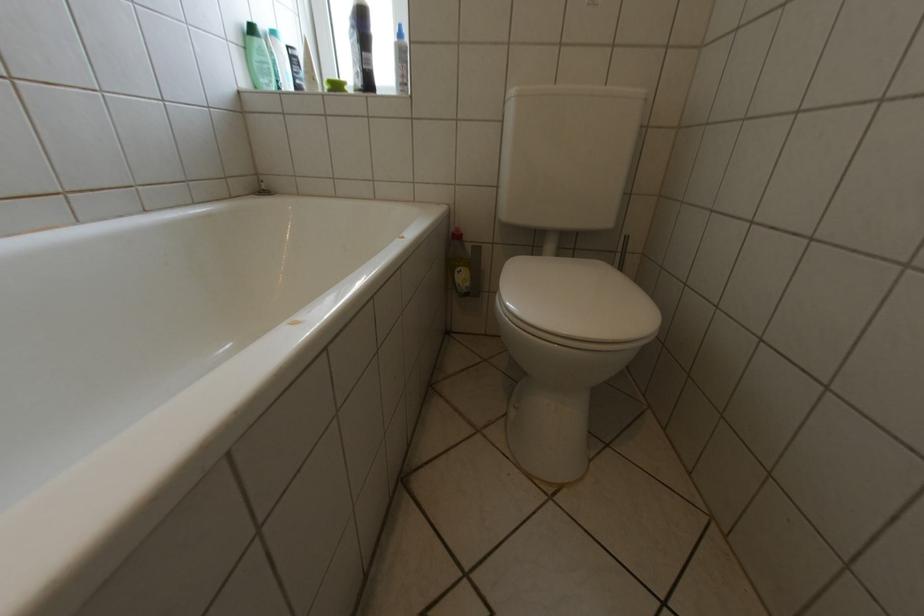
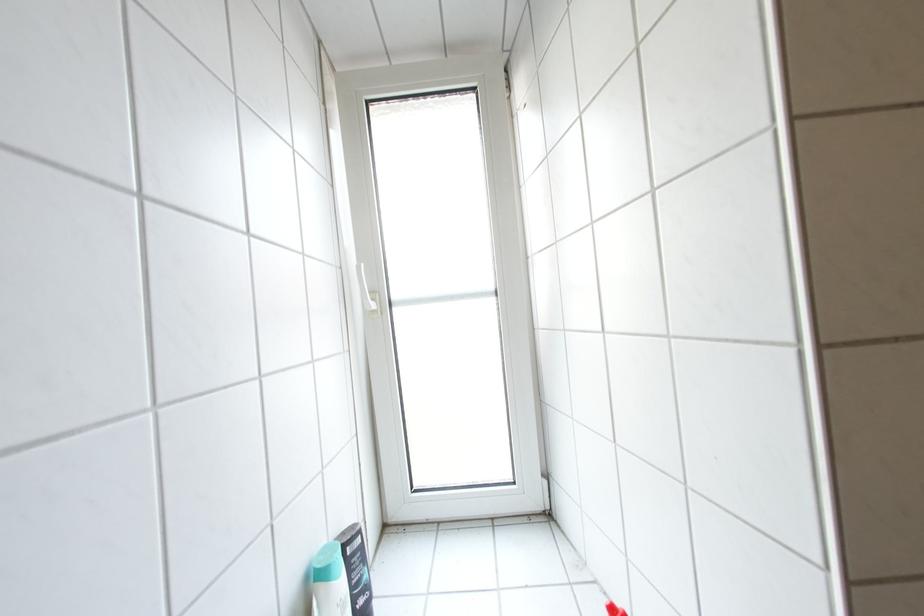
What movement of the cameraman would produce the second image?

The cameraman moved toward left, forward.